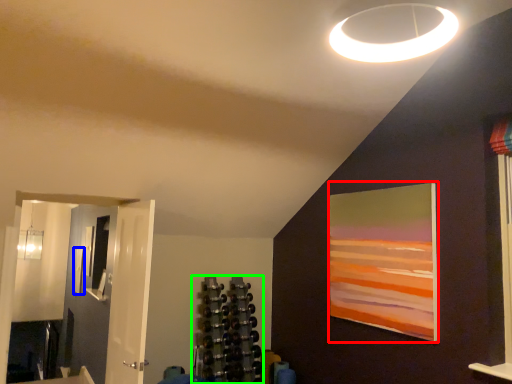
Question: Which object is the closest to the picture frame (highlighted by a red box)? Choose among these: picture frame (highlighted by a blue box) or shelf (highlighted by a green box).

Choices:
 (A) picture frame
 (B) shelf

Answer: (B)